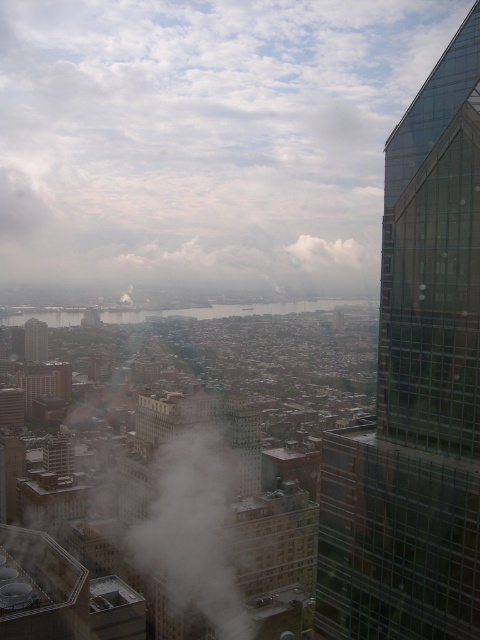
Is transparent glass skyscraper at right shorter than matte glass skyscraper at center-left?

No, transparent glass skyscraper at right is not shorter than matte glass skyscraper at center-left.

Does point (387, 486) lie in front of point (26, 362)?

Yes.

Where is `transparent glass skyscraper at right`? transparent glass skyscraper at right is located at coordinates (416, 388).

Which of these two, white fluffy cloud at center or matte glass skyscraper at center-left, stands taller?

matte glass skyscraper at center-left

Does white fluffy cloud at center have a smaller size compared to matte glass skyscraper at center-left?

Incorrect, white fluffy cloud at center is not smaller in size than matte glass skyscraper at center-left.

Identify the location of white fluffy cloud at center. This screenshot has width=480, height=640. pyautogui.click(x=325, y=252).

Does white fluffy cloud at upper center come in front of transparent glass skyscraper at right?

No.

Between white fluffy cloud at upper center and transparent glass skyscraper at right, which one appears on the right side from the viewer's perspective?

Positioned to the right is transparent glass skyscraper at right.

Locate an element on the screen. The width and height of the screenshot is (480, 640). white fluffy cloud at upper center is located at coordinates (203, 136).